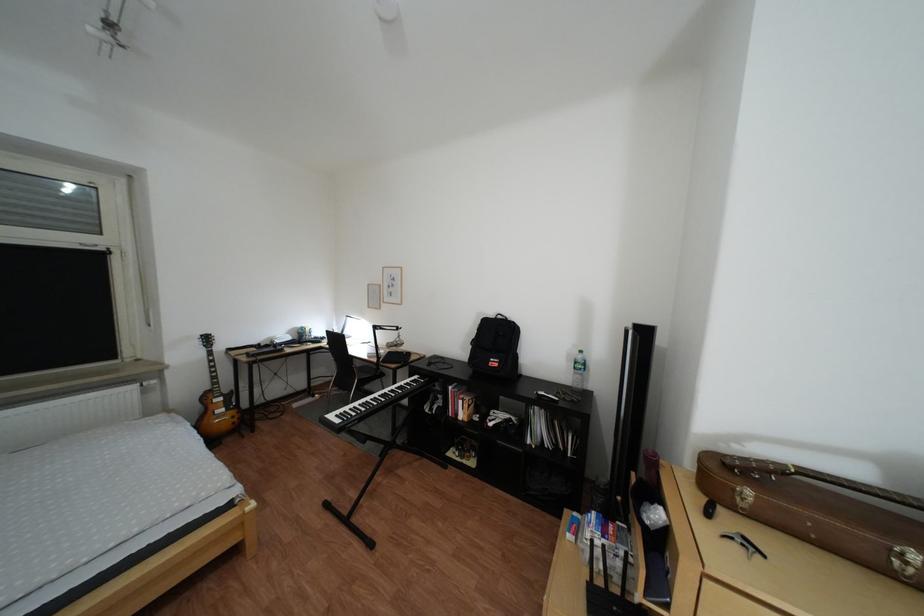
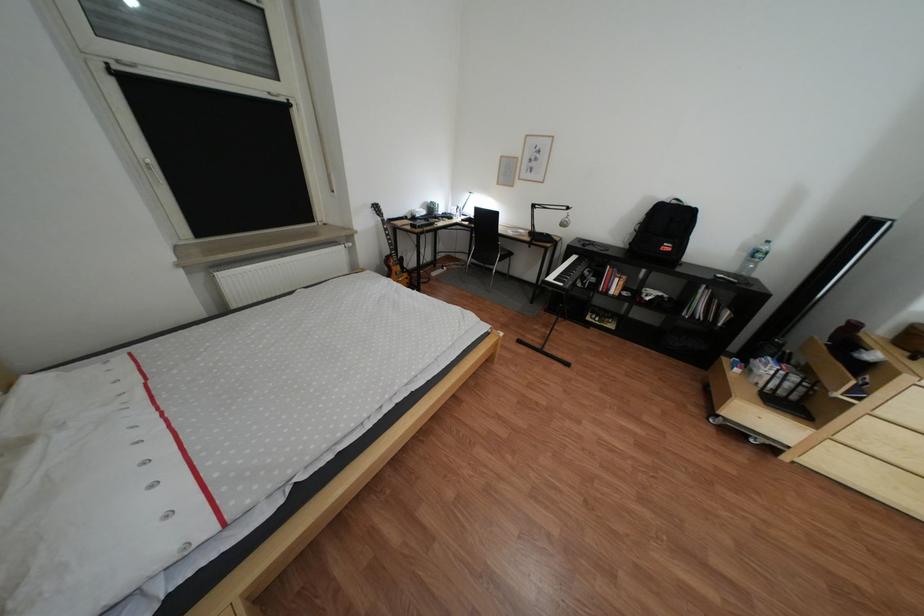
Find the pixel in the second image that matches point (509, 363) in the first image.

(683, 248)